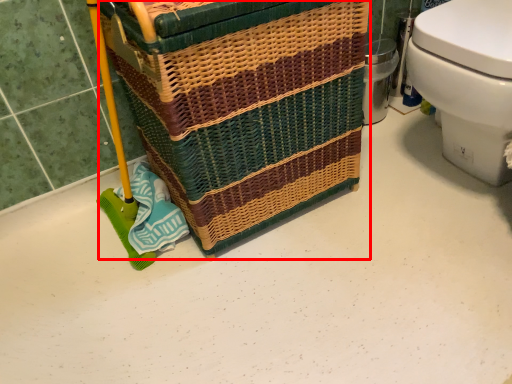
Question: From the image's perspective, where is basket container (annotated by the red box) located in relation to toilet in the image?

Choices:
 (A) below
 (B) above

Answer: (A)